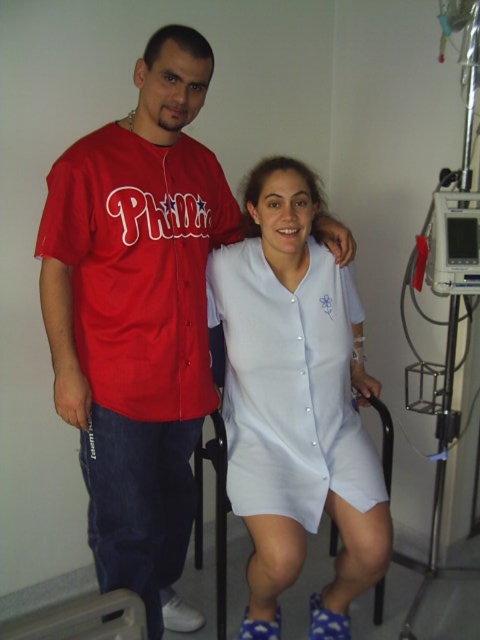
You are a nurse in a hospital. You need to move a medical chart from the matte jersey at left to the white matte hospital gown at center. The chart is 14 inches long. Is there enough space between them to place the chart without moving either item?

The white matte hospital gown at center is 12.48 inches away from the matte jersey at left. Since the chart is 14 inches long, it would not fit in the available space between them.

You are a nurse in a hospital. You need to move a medical chart from the matte jersey at center to the white matte hospital gown at center. Considering their heights, will you need to adjust your movement to reach the recipient?

The matte jersey at center is much taller than the white matte hospital gown at center. Therefore, you will need to lower the chart when transferring it to ensure it is at an appropriate height for the white matte hospital gown at center.